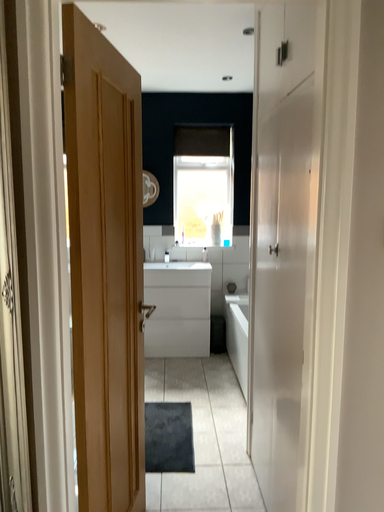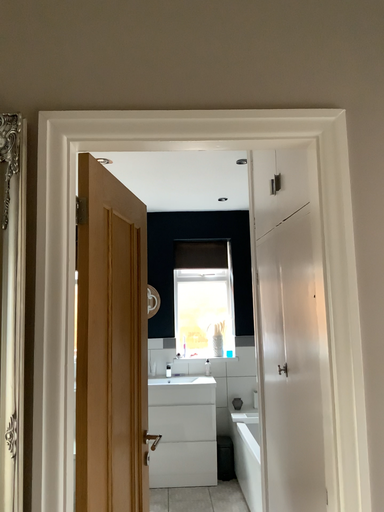
Question: Which way did the camera rotate in the video?

Choices:
 (A) rotated upward
 (B) rotated downward

Answer: (A)